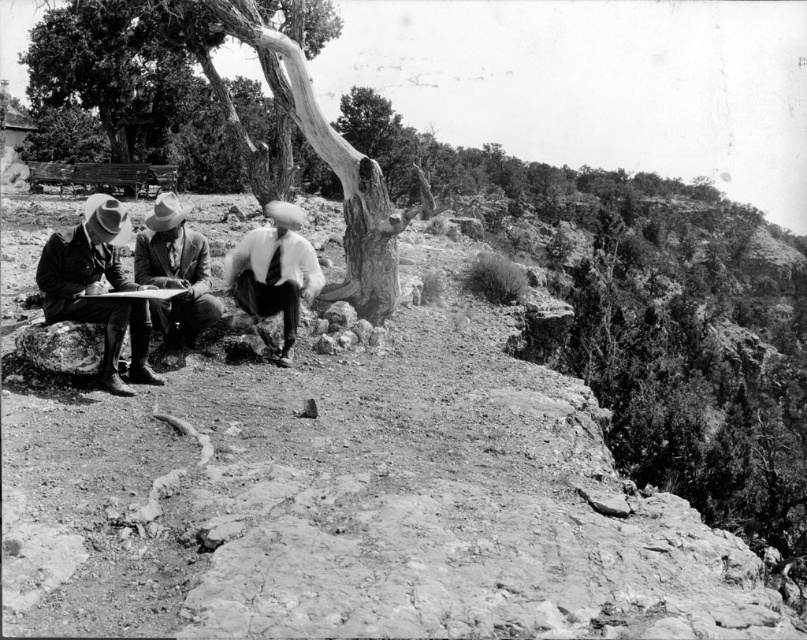
Who is shorter, smooth bark tree at center or white cotton shirt at center?

With less height is white cotton shirt at center.

Does point (283, 102) lie behind point (281, 272)?

Yes, point (283, 102) is farther from viewer.

Find the location of a particular element. The width and height of the screenshot is (807, 640). smooth bark tree at center is located at coordinates coord(320,152).

Is rugged stone hillside at center below matte black suit at left?

Correct, rugged stone hillside at center is located below matte black suit at left.

Who is positioned more to the right, rugged stone hillside at center or matte black suit at left?

From the viewer's perspective, rugged stone hillside at center appears more on the right side.

Is point (693, 547) more distant than point (136, 339)?

No, (693, 547) is in front of (136, 339).

Image resolution: width=807 pixels, height=640 pixels. Find the location of `rugged stone hillside at center`. rugged stone hillside at center is located at coordinates (341, 492).

Is rugged stone hillside at center bigger than smooth brown suit at center?

Correct, rugged stone hillside at center is larger in size than smooth brown suit at center.

Who is more distant from viewer, (622, 625) or (169, 333)?

Positioned behind is point (169, 333).

Image resolution: width=807 pixels, height=640 pixels. Identify the location of rugged stone hillside at center. (341, 492).